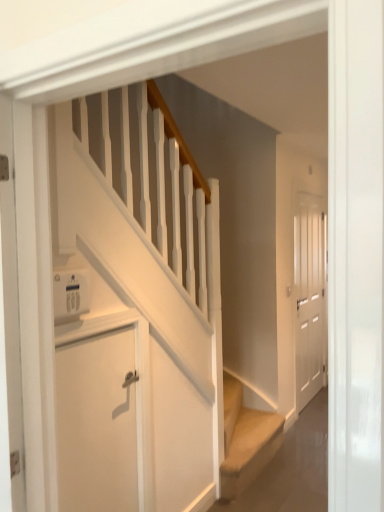
Question: Considering the relative sizes of white matte door at right, which appears as the 1th door when viewed from the right, and white matte door at lower left, which appears as the 1th door when viewed from the front, in the image provided, is white matte door at right, which appears as the 1th door when viewed from the right, thinner than white matte door at lower left, which appears as the 1th door when viewed from the front,?

Choices:
 (A) no
 (B) yes

Answer: (A)

Question: Is white matte door at right, the 1th door viewed from the back, oriented towards white matte door at lower left, which appears as the first door when viewed from the left?

Choices:
 (A) no
 (B) yes

Answer: (A)

Question: Is white matte door at right, the 1th door viewed from the back, wider than white matte door at lower left, which appears as the 1th door when viewed from the front?

Choices:
 (A) yes
 (B) no

Answer: (A)

Question: Is white matte door at right, which appears as the 1th door when viewed from the right, positioned with its back to white matte door at lower left, which appears as the first door when viewed from the left?

Choices:
 (A) no
 (B) yes

Answer: (A)

Question: Can white matte door at lower left, which appears as the 1th door when viewed from the front, be found inside white matte door at right, the second door in the left-to-right sequence?

Choices:
 (A) yes
 (B) no

Answer: (B)

Question: From the image's perspective, is white matte door at right, arranged as the 2th door when viewed from the front, positioned above or below white plastic thermostat at upper left?

Choices:
 (A) below
 (B) above

Answer: (A)

Question: Does point (312, 257) appear closer or farther from the camera than point (64, 282)?

Choices:
 (A) closer
 (B) farther

Answer: (B)

Question: Considering the positions of white matte door at right, the second door in the left-to-right sequence, and white plastic thermostat at upper left in the image, is white matte door at right, the second door in the left-to-right sequence, wider or thinner than white plastic thermostat at upper left?

Choices:
 (A) thin
 (B) wide

Answer: (A)

Question: Based on their sizes in the image, would you say white matte door at right, arranged as the 2th door when viewed from the front, is bigger or smaller than white plastic thermostat at upper left?

Choices:
 (A) big
 (B) small

Answer: (A)

Question: Is point (59, 301) closer or farther from the camera than point (127, 481)?

Choices:
 (A) farther
 (B) closer

Answer: (B)

Question: From the image's perspective, is white plastic thermostat at upper left above or below white matte door at lower left, the second door positioned from the back?

Choices:
 (A) below
 (B) above

Answer: (B)

Question: In the image, is white plastic thermostat at upper left on the left side or the right side of white matte door at lower left, which appears as the first door when viewed from the left?

Choices:
 (A) left
 (B) right

Answer: (A)

Question: Considering the positions of white plastic thermostat at upper left and white matte door at lower left, which ranks as the second door in right-to-left order, in the image, is white plastic thermostat at upper left wider or thinner than white matte door at lower left, which ranks as the second door in right-to-left order,?

Choices:
 (A) wide
 (B) thin

Answer: (A)

Question: From the image's perspective, relative to white matte door at right, the 1th door viewed from the back, is white matte door at lower left, which appears as the first door when viewed from the left, above or below?

Choices:
 (A) below
 (B) above

Answer: (A)

Question: Would you say white matte door at lower left, which appears as the 1th door when viewed from the front, is to the left or to the right of white matte door at right, which appears as the 1th door when viewed from the right, in the picture?

Choices:
 (A) left
 (B) right

Answer: (A)